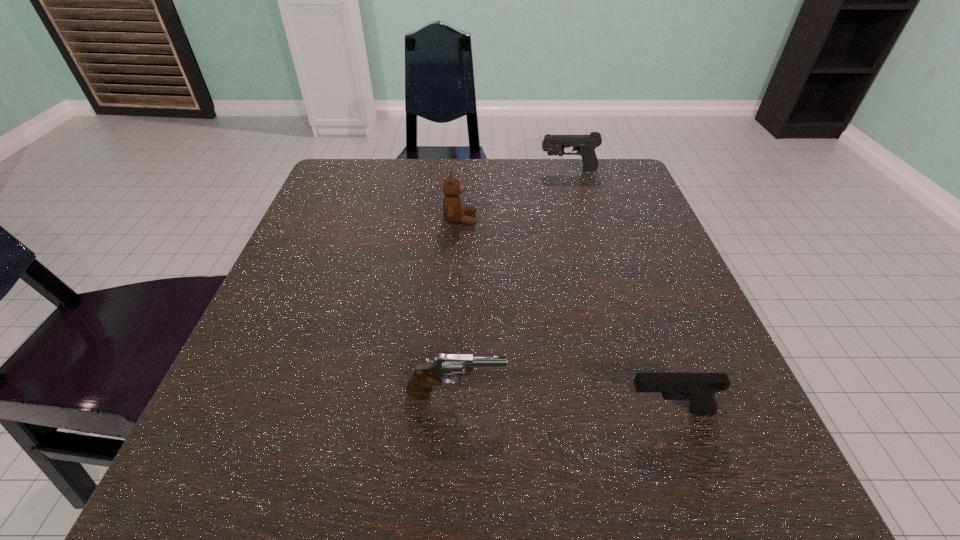
Where is `vacant space located on the front-facing side of the nearest pistol`? The width and height of the screenshot is (960, 540). vacant space located on the front-facing side of the nearest pistol is located at coordinates (506, 411).

The width and height of the screenshot is (960, 540). Find the location of `vacant space located 0.080m on the front-facing side of the nearest pistol`. vacant space located 0.080m on the front-facing side of the nearest pistol is located at coordinates (564, 411).

What are the coordinates of `vacant space located 0.140m on the front-facing side of the nearest pistol` in the screenshot? It's located at (520, 411).

This screenshot has height=540, width=960. In order to click on teddy bear present at the far edge in this screenshot , I will do `click(453, 211)`.

I want to click on pistol present at the far edge, so click(585, 145).

Locate an element on the screen. object located in the far right corner section of the desktop is located at coordinates (585, 145).

The width and height of the screenshot is (960, 540). What are the coordinates of `free spot at the far edge of the desktop` in the screenshot? It's located at (440, 167).

You are a GUI agent. You are given a task and a screenshot of the screen. Output one action in this format:
    pyautogui.click(x=<x>, y=<y>)
    Task: Click on the vacant region at the near edge of the desktop
    Image resolution: width=960 pixels, height=540 pixels.
    Given the screenshot: What is the action you would take?
    pyautogui.click(x=431, y=502)

Identify the location of free location at the left edge of the desktop. The height and width of the screenshot is (540, 960). (342, 335).

What are the coordinates of `vacant space at the right edge of the desktop` in the screenshot? It's located at (668, 325).